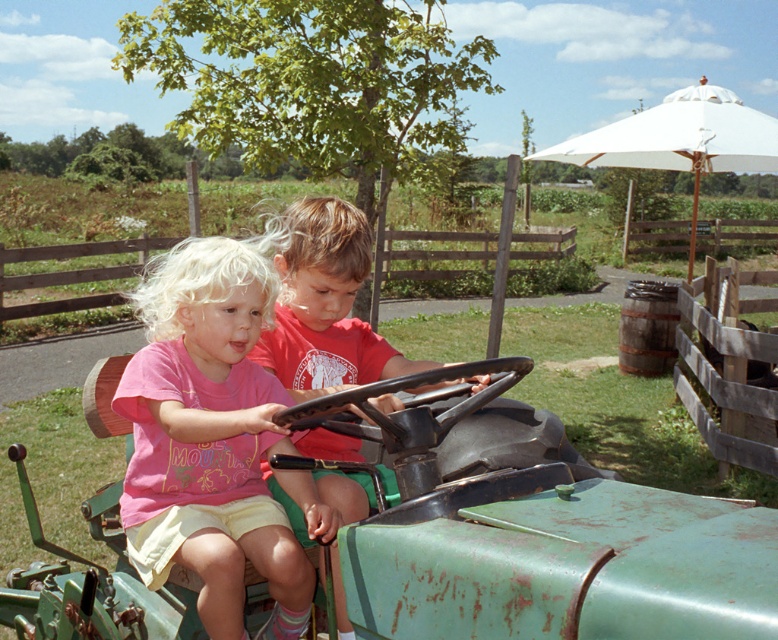
Is point (37, 577) positioned behind point (167, 540)?

Yes, point (37, 577) is farther from viewer.

Does rusty green tractor at center have a greater width compared to pink cotton shirt at center?

Yes, rusty green tractor at center is wider than pink cotton shirt at center.

Is point (668, 576) farther from viewer compared to point (282, 440)?

No.

What are the coordinates of `rusty green tractor at center` in the screenshot? It's located at (534, 529).

Is pink cotton shirt at center wider than matte red shirt at center?

No, pink cotton shirt at center is not wider than matte red shirt at center.

Does pink cotton shirt at center have a smaller size compared to matte red shirt at center?

Yes, pink cotton shirt at center is smaller than matte red shirt at center.

The width and height of the screenshot is (778, 640). I want to click on pink cotton shirt at center, so click(x=209, y=436).

Consider the image. Does rusty green tractor at center appear over matte red shirt at center?

No.

Is rusty green tractor at center shorter than matte red shirt at center?

Yes.

Who is more distant from viewer, (x=475, y=556) or (x=261, y=337)?

The point (x=261, y=337) is behind.

At what (x,y) coordinates should I click in order to perform the action: click on rusty green tractor at center. Please return your answer as a coordinate pair (x, y). Looking at the image, I should click on (534, 529).